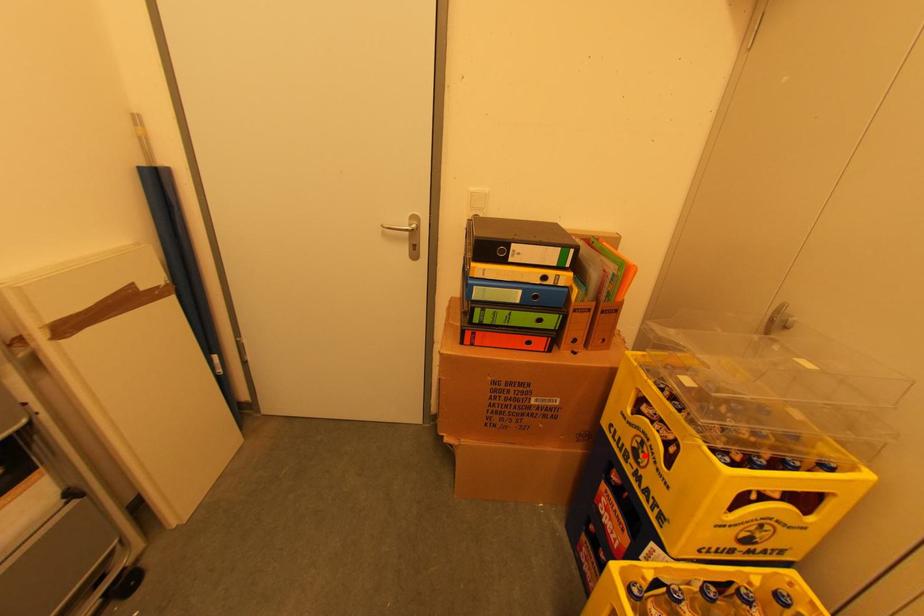
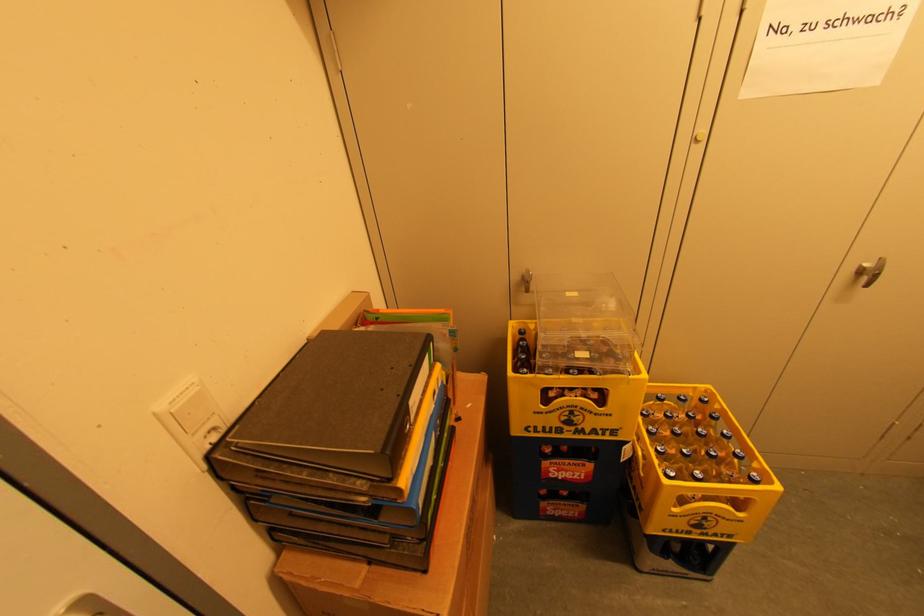
Question: A red point is marked in image1. In image2, is the corresponding 3D point closer to the camera or farther? Reply with the corresponding letter.

Choices:
 (A) The corresponding 3D point is closer.
 (B) The corresponding 3D point is farther.

Answer: (B)